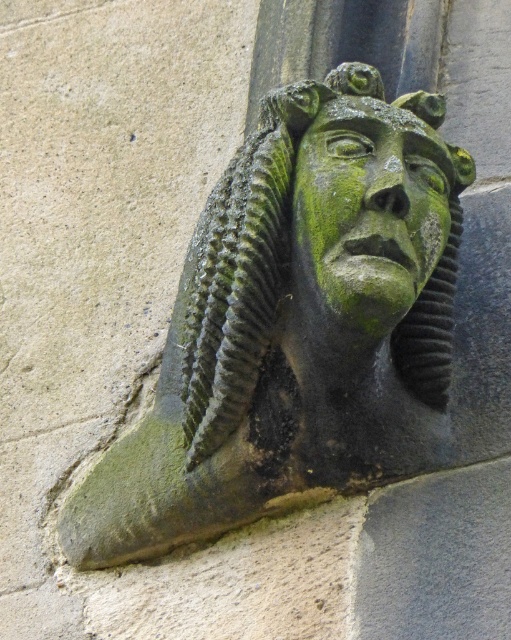
Between green stone head at center and green stone face at center, which one has more height?

green stone head at center

Is point (415, 227) positioned after point (371, 298)?

Yes, it is behind point (371, 298).

Measure the distance between green stone head at center and camera.

green stone head at center and camera are 149.76 feet apart from each other.

This screenshot has height=640, width=511. I want to click on green stone head at center, so click(290, 317).